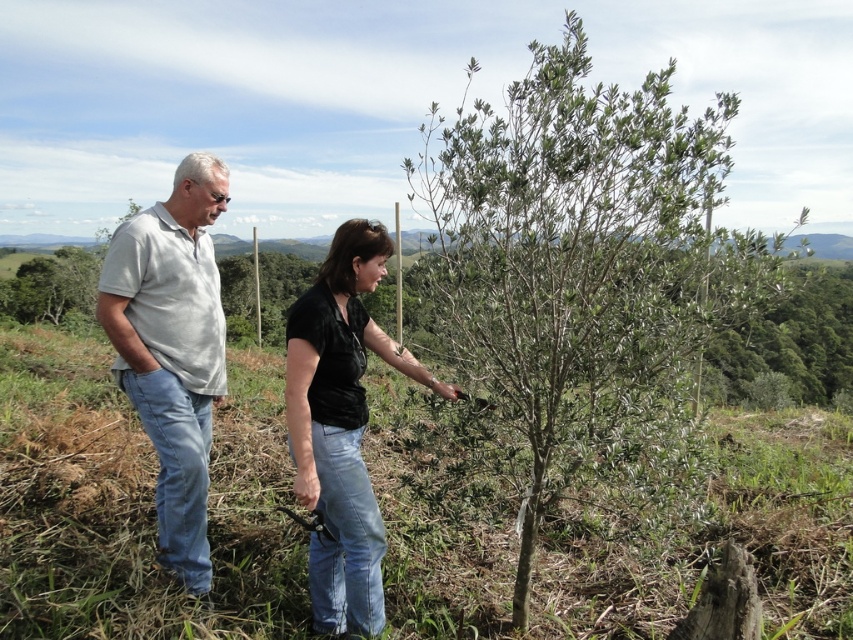
Is green leafy shrub at center taller than gray cotton shirt at left?

Yes, green leafy shrub at center is taller than gray cotton shirt at left.

Does green leafy shrub at center have a smaller size compared to gray cotton shirt at left?

Incorrect, green leafy shrub at center is not smaller in size than gray cotton shirt at left.

Does point (560, 268) lie behind point (196, 472)?

No, (560, 268) is in front of (196, 472).

Find the location of a particular element. green leafy shrub at center is located at coordinates (585, 273).

Is gray cotton shirt at left to the left of black matte shirt at center from the viewer's perspective?

Indeed, gray cotton shirt at left is positioned on the left side of black matte shirt at center.

Does gray cotton shirt at left have a lesser height compared to black matte shirt at center?

No, gray cotton shirt at left is not shorter than black matte shirt at center.

Find the location of a particular element. gray cotton shirt at left is located at coordinates (172, 348).

Identify the location of gray cotton shirt at left. The height and width of the screenshot is (640, 853). click(172, 348).

Does green leafy shrub at center have a lesser width compared to black matte shirt at center?

No.

This screenshot has width=853, height=640. I want to click on green leafy shrub at center, so click(585, 273).

Where is `green leafy shrub at center`? green leafy shrub at center is located at coordinates (585, 273).